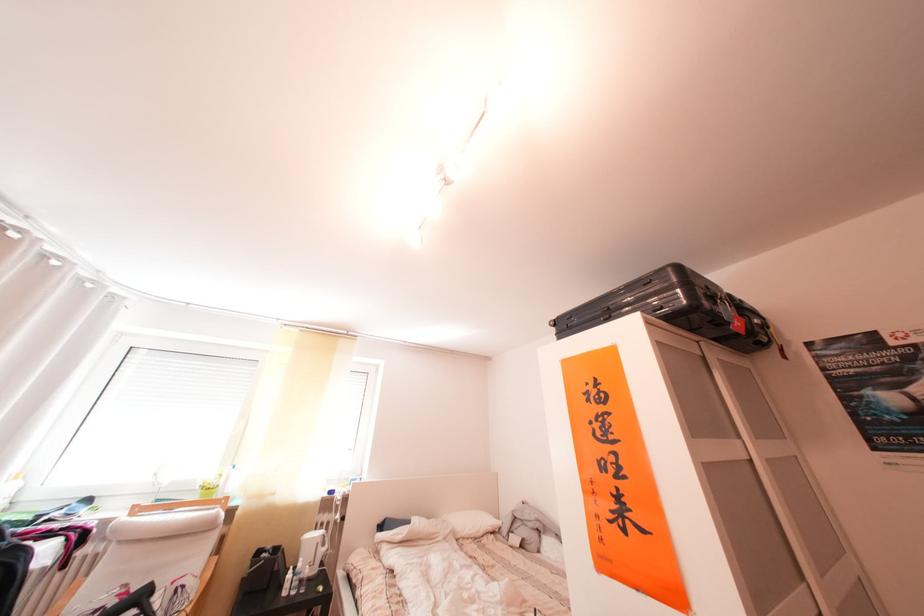
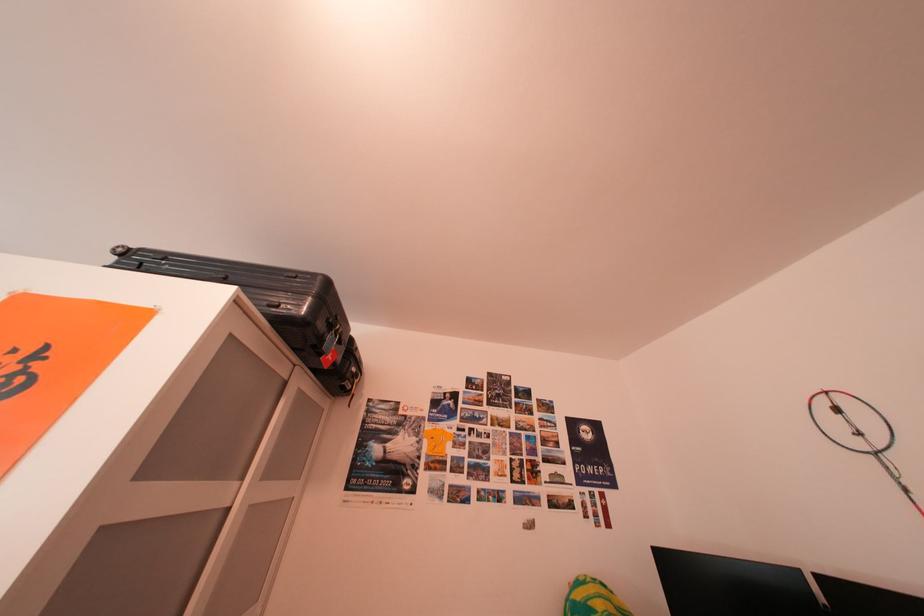
Based on the photo, the images are taken continuously from a first-person perspective. In which direction is your viewpoint rotating?

The camera's rotation is toward right-up.